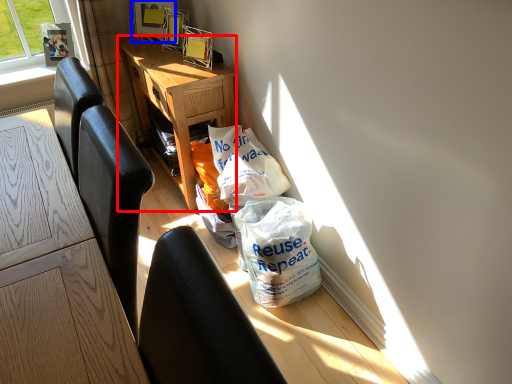
Question: Which object appears farthest to the camera in this image, desk (highlighted by a red box) or picture frame (highlighted by a blue box)?

Choices:
 (A) desk
 (B) picture frame

Answer: (B)